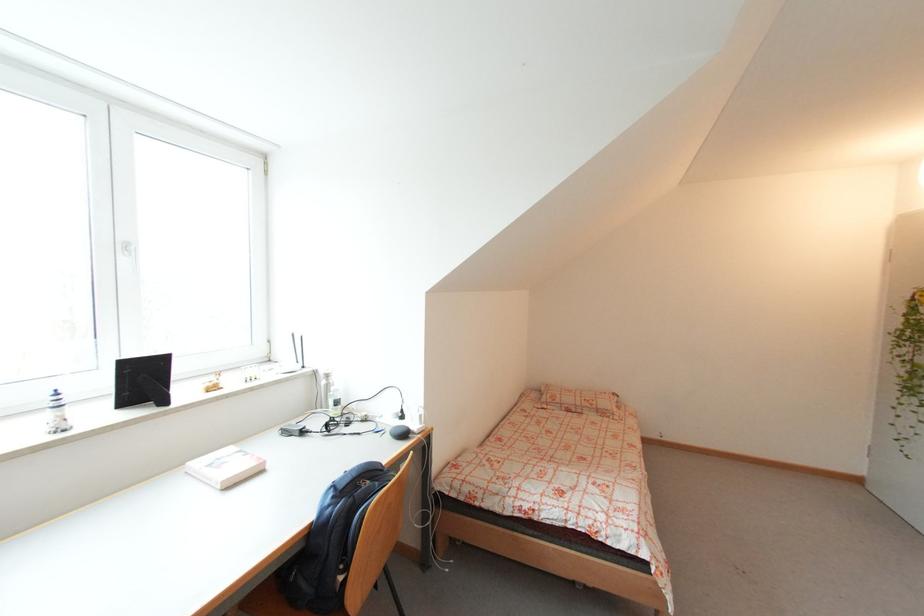
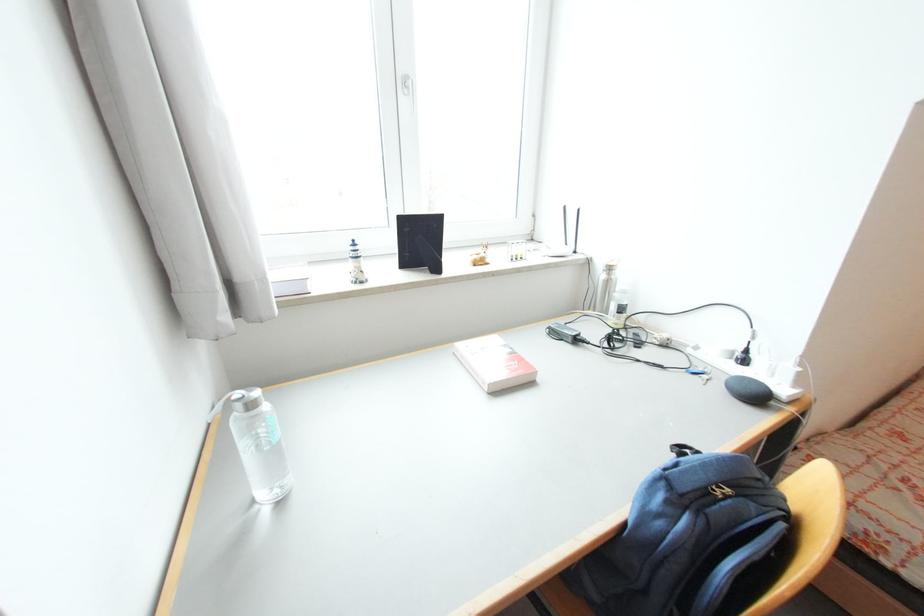
Find the pixel in the second image that matches pixel 395 435 in the first image.

(734, 387)